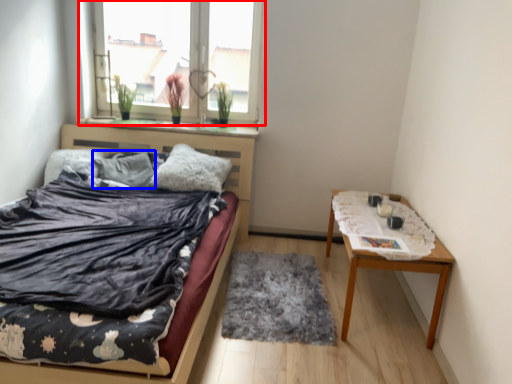
Question: Which point is further to the camera, window (highlighted by a red box) or pillow (highlighted by a blue box)?

Choices:
 (A) window
 (B) pillow

Answer: (A)